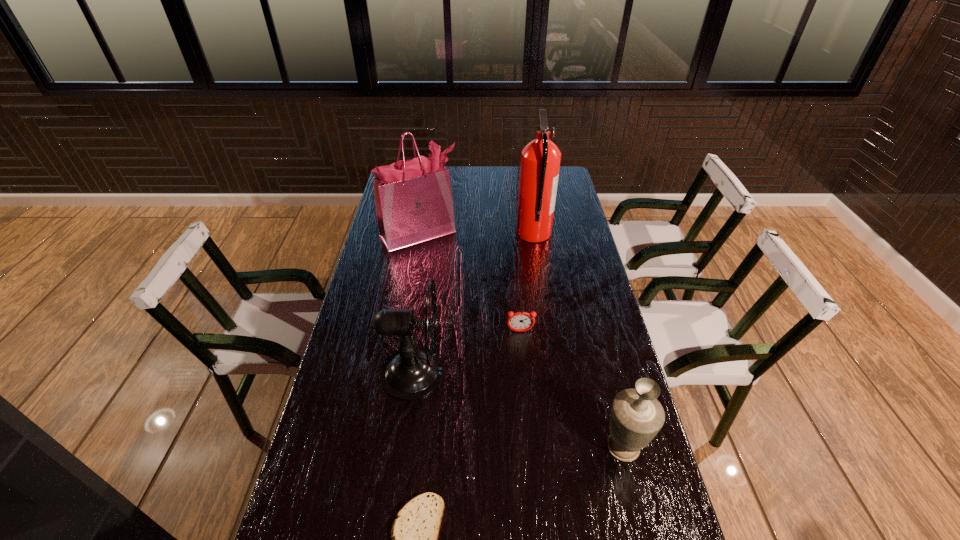
Locate an element on the screen. This screenshot has width=960, height=540. vacant space at the right edge is located at coordinates (577, 276).

Find the location of a particular element. This screenshot has height=540, width=960. vacant space at the far right corner of the desktop is located at coordinates (562, 183).

Locate an element on the screen. This screenshot has width=960, height=540. free spot between the fire extinguisher and the shopping bag is located at coordinates (476, 234).

Locate an element on the screen. This screenshot has height=540, width=960. empty space that is in between the fire extinguisher and the fourth nearest object is located at coordinates coord(527,282).

The image size is (960, 540). I want to click on vacant space in between the second nearest object and the alarm clock, so click(572, 389).

Locate an element on the screen. empty location between the fan and the urn is located at coordinates (520, 409).

Locate an element on the screen. vacant area between the alarm clock and the third shortest object is located at coordinates (572, 389).

This screenshot has width=960, height=540. I want to click on object that stands as the closest to the fourth nearest object, so click(x=412, y=372).

Locate which object is the fourth closest to the fire extinguisher. Please provide its 2D coordinates. Your answer should be formatted as a tuple, i.e. [(x, y)], where the tuple contains the x and y coordinates of a point satisfying the conditions above.

[(636, 417)]

Where is `vacant region that satisfies the following two spatial constraints: 1. at the nozzle of the fire extinguisher; 2. on the back side of the rightmost object`? The height and width of the screenshot is (540, 960). vacant region that satisfies the following two spatial constraints: 1. at the nozzle of the fire extinguisher; 2. on the back side of the rightmost object is located at coordinates (566, 447).